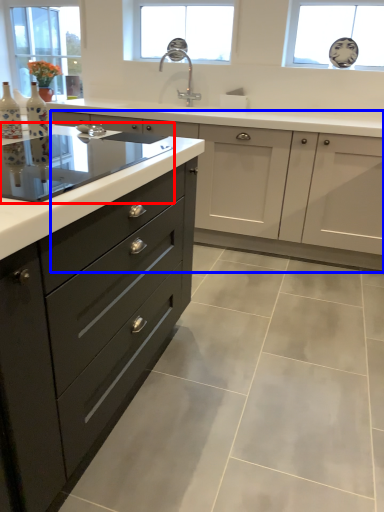
Question: Among these objects, which one is nearest to the camera, home appliance (highlighted by a red box) or cabinetry (highlighted by a blue box)?

Choices:
 (A) home appliance
 (B) cabinetry

Answer: (A)